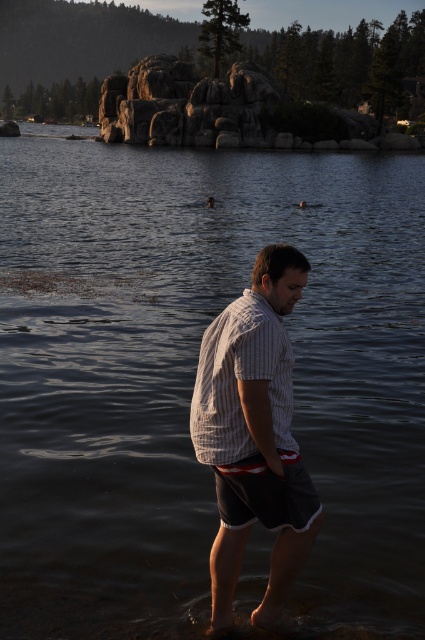
Question: Which of the following is the farthest from the observer?

Choices:
 (A) white striped shirt at center
 (B) dark gray cotton shorts at center

Answer: (B)

Question: Is striped cotton shirt at center bigger than white striped shirt at center?

Choices:
 (A) no
 (B) yes

Answer: (B)

Question: Considering the real-world distances, which object is closest to the white striped shirt at center?

Choices:
 (A) dark gray cotton shorts at center
 (B) striped cotton shirt at center

Answer: (B)

Question: Which point appears closest to the camera in this image?

Choices:
 (A) (302, 484)
 (B) (282, 365)

Answer: (B)

Question: Observing the image, what is the correct spatial positioning of white striped shirt at center in reference to dark gray cotton shorts at center?

Choices:
 (A) below
 (B) above

Answer: (B)

Question: Can you confirm if striped cotton shirt at center is wider than dark gray cotton shorts at center?

Choices:
 (A) no
 (B) yes

Answer: (B)